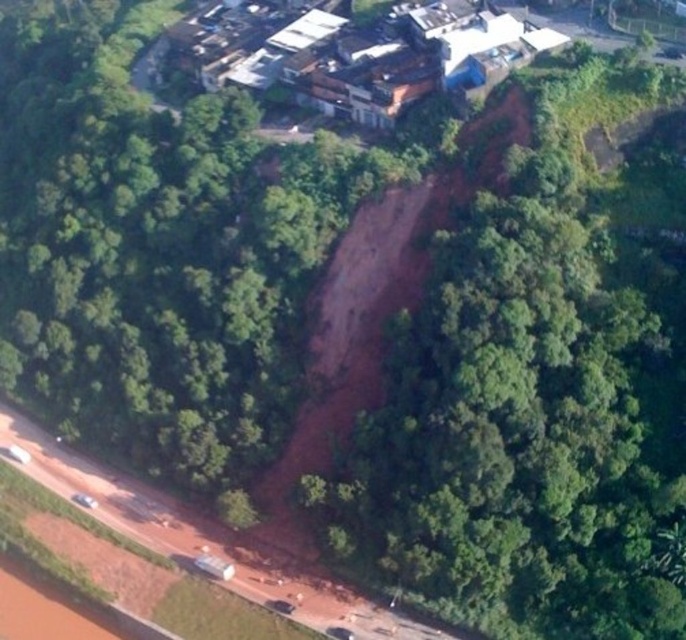
Question: Which point is farther to the camera?

Choices:
 (A) brown wooden houses at upper center
 (B) brown dirt cliff at center

Answer: (A)

Question: Where is brown dirt cliff at center located in relation to brown wooden houses at upper center in the image?

Choices:
 (A) left
 (B) right

Answer: (B)

Question: Can you confirm if brown dirt cliff at center is positioned to the right of brown wooden houses at upper center?

Choices:
 (A) no
 (B) yes

Answer: (B)

Question: Can you confirm if brown dirt cliff at center is smaller than brown wooden houses at upper center?

Choices:
 (A) yes
 (B) no

Answer: (B)